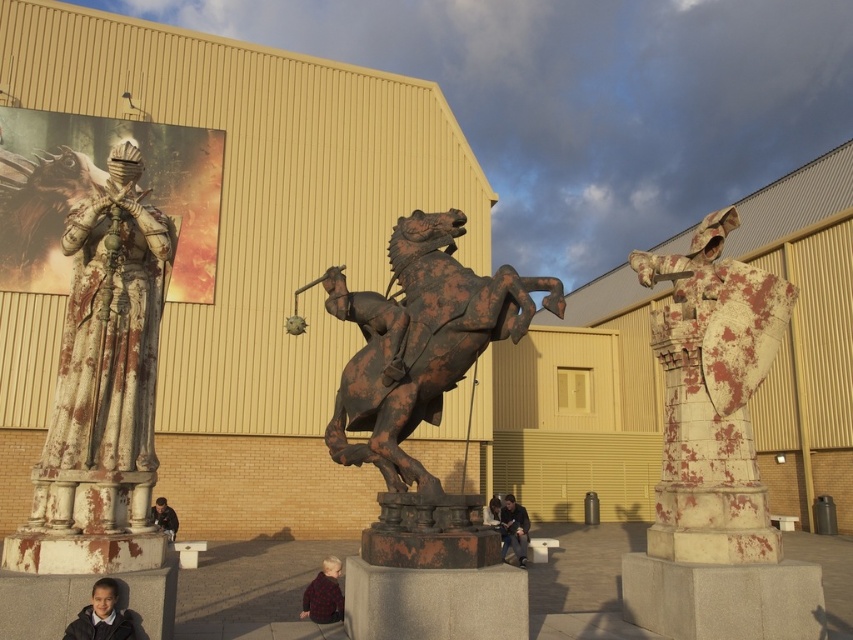
You are standing in front of the three statues in the scene. You notice two points marked on the statues. The first point is at coordinates point (688, 276) and the second point is at point (323, 618). Which of these points is closer to you?

Point (688, 276) is further to the viewer than point (323, 618), so the point closer to you is point (323, 618).

You are an art conservator assessing the statues in front of the beige building. You notice the rusty metal horseman at center and the dark brown leather jacket at center. Which of these two items is located to the left when viewed from the front of the building?

The rusty metal horseman at center is positioned on the left side of dark brown leather jacket at center, so when viewed from the front of the building, the rusty metal horseman at center is to the left of the dark brown leather jacket at center.

You are standing in front of the statues and want to place a plaid wool sweater at lower center and a dark gray fabric jacket at center. Which item is positioned to the left of the other?

The plaid wool sweater at lower center is positioned to the left of the dark gray fabric jacket at center.